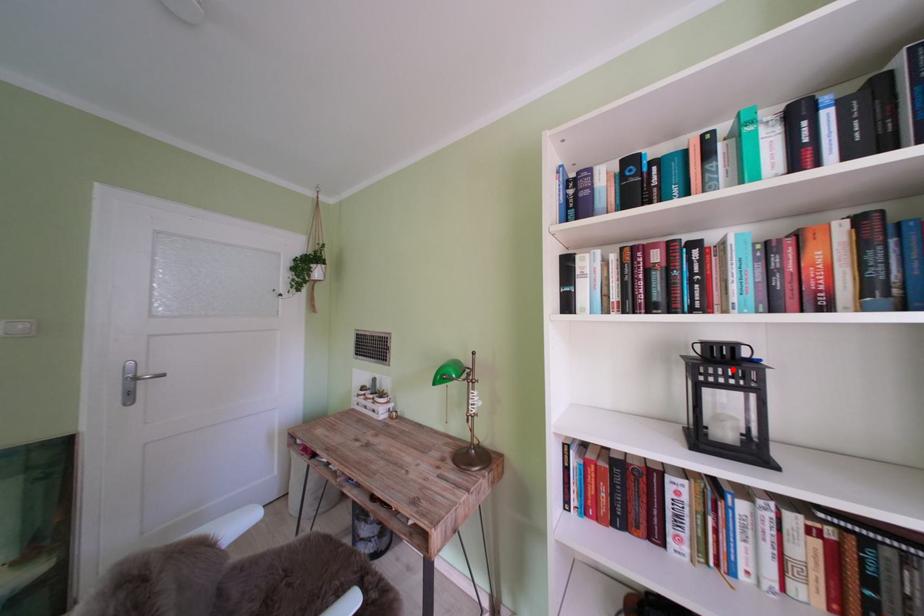
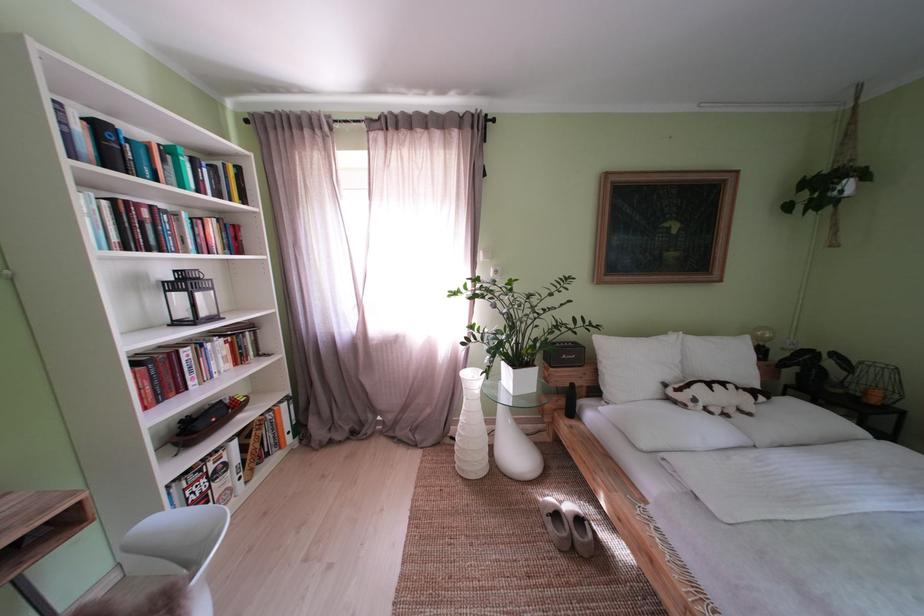
Locate, in the second image, the point that corresponds to the highlighted location in the first image.

(198, 286)